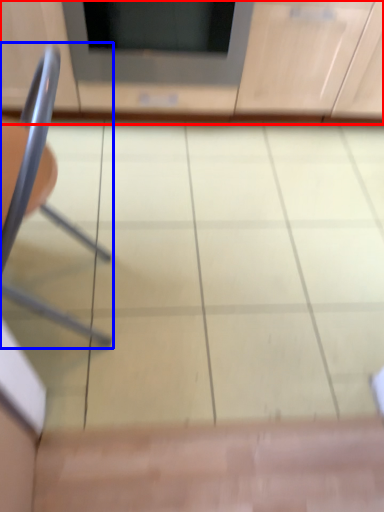
Question: Which object is closer to the camera taking this photo, cabinetry (highlighted by a red box) or chair (highlighted by a blue box)?

Choices:
 (A) cabinetry
 (B) chair

Answer: (B)